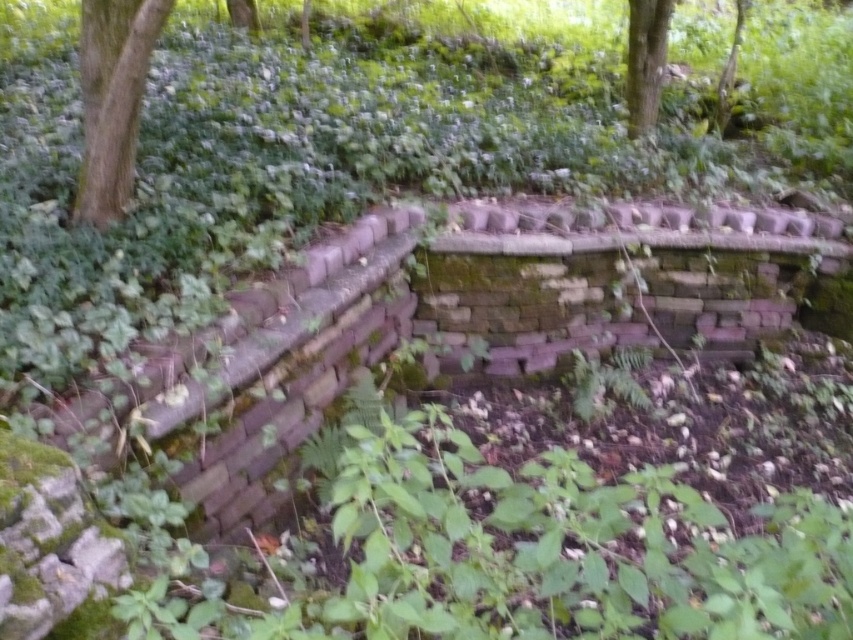
Is green rough bark tree at upper left smaller than green mossy tree at upper center?

No, green rough bark tree at upper left is not smaller than green mossy tree at upper center.

The image size is (853, 640). Describe the element at coordinates (112, 97) in the screenshot. I see `green rough bark tree at upper left` at that location.

Identify the location of green rough bark tree at upper left. coord(112,97).

Identify the location of green rough bark tree at upper left. (112, 97).